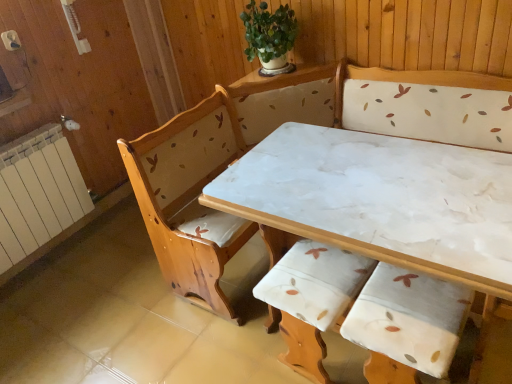
Locate an element on the screen. This screenshot has height=384, width=512. free spot below green leafy plant at upper center (from a real-world perspective) is located at coordinates (277, 76).